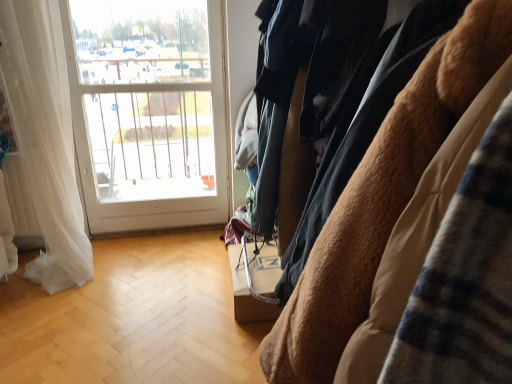
Question: From the image's perspective, would you say brown fuzzy coat at right is shown under white glass window at upper left?

Choices:
 (A) yes
 (B) no

Answer: (A)

Question: Can you confirm if brown fuzzy coat at right is thinner than white glass window at upper left?

Choices:
 (A) no
 (B) yes

Answer: (A)

Question: Is white glass window at upper left inside brown fuzzy coat at right?

Choices:
 (A) yes
 (B) no

Answer: (B)

Question: Considering the relative sizes of brown fuzzy coat at right and white glass window at upper left in the image provided, is brown fuzzy coat at right shorter than white glass window at upper left?

Choices:
 (A) yes
 (B) no

Answer: (A)

Question: Is brown fuzzy coat at right to the right of white glass window at upper left from the viewer's perspective?

Choices:
 (A) yes
 (B) no

Answer: (A)

Question: From a real-world perspective, is brown fuzzy coat at right positioned above or below white sheer curtain at left?

Choices:
 (A) above
 (B) below

Answer: (A)

Question: In terms of height, does brown fuzzy coat at right look taller or shorter compared to white sheer curtain at left?

Choices:
 (A) short
 (B) tall

Answer: (A)

Question: Looking at their shapes, would you say brown fuzzy coat at right is wider or thinner than white sheer curtain at left?

Choices:
 (A) wide
 (B) thin

Answer: (A)

Question: Considering the positions of point (285, 352) and point (51, 84), is point (285, 352) closer or farther from the camera than point (51, 84)?

Choices:
 (A) farther
 (B) closer

Answer: (B)

Question: Considering the relative positions of white sheer curtain at left and white glass window at upper left in the image provided, is white sheer curtain at left to the left or to the right of white glass window at upper left?

Choices:
 (A) left
 (B) right

Answer: (A)

Question: From the image's perspective, is white sheer curtain at left located above or below white glass window at upper left?

Choices:
 (A) below
 (B) above

Answer: (A)

Question: In terms of height, does white sheer curtain at left look taller or shorter compared to white glass window at upper left?

Choices:
 (A) short
 (B) tall

Answer: (A)

Question: Is point [x=50, y=193] positioned closer to the camera than point [x=203, y=100]?

Choices:
 (A) closer
 (B) farther

Answer: (A)

Question: Would you say white glass window at upper left is to the left or to the right of brown fuzzy coat at right in the picture?

Choices:
 (A) right
 (B) left

Answer: (B)

Question: From a real-world perspective, relative to brown fuzzy coat at right, is white glass window at upper left vertically above or below?

Choices:
 (A) above
 (B) below

Answer: (B)